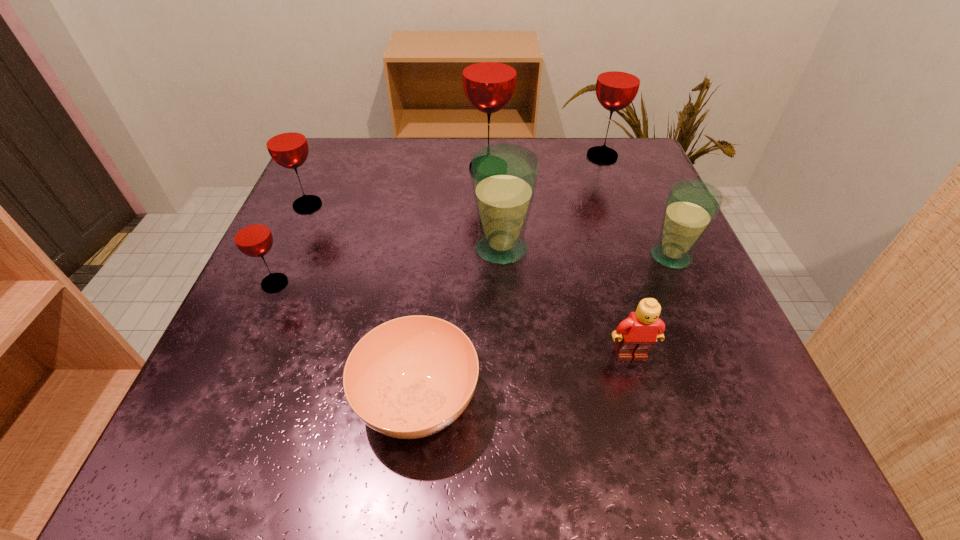
Locate an element on the screen. The image size is (960, 540). free spot located on the back of the shortest object is located at coordinates (432, 272).

Find the location of `object present at the near edge`. object present at the near edge is located at coordinates (411, 377).

Locate an element on the screen. This screenshot has height=540, width=960. Lego at the right edge is located at coordinates (636, 335).

Locate an element on the screen. This screenshot has width=960, height=540. object positioned at the far left corner is located at coordinates (286, 142).

Locate an element on the screen. The height and width of the screenshot is (540, 960). object at the far right corner is located at coordinates (618, 81).

You are a GUI agent. You are given a task and a screenshot of the screen. Output one action in this format:
    pyautogui.click(x=<x>, y=<y>)
    Task: Click on the free space at the far edge
    This screenshot has width=960, height=540.
    Given the screenshot: What is the action you would take?
    [x=561, y=195]

This screenshot has height=540, width=960. In order to click on vacant position at the near edge of the desktop in this screenshot , I will do `click(506, 444)`.

The image size is (960, 540). Find the location of `vacant space at the left edge`. vacant space at the left edge is located at coordinates (286, 245).

At what (x,y) coordinates should I click in order to perform the action: click on free space at the right edge of the desktop. Please return your answer as a coordinate pair (x, y). The image size is (960, 540). Looking at the image, I should click on (643, 203).

At what (x,y) coordinates should I click in order to perform the action: click on free spot at the far left corner of the desktop. Please return your answer as a coordinate pair (x, y). Looking at the image, I should click on (339, 151).